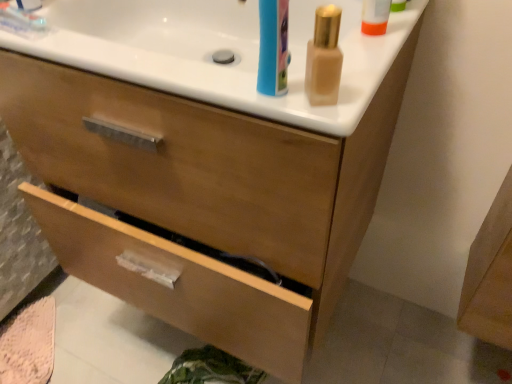
Question: From the image's perspective, is satin gold bottle at upper right above or below white glossy counter top at upper center?

Choices:
 (A) above
 (B) below

Answer: (B)

Question: Does point (325, 18) appear closer or farther from the camera than point (156, 11)?

Choices:
 (A) farther
 (B) closer

Answer: (B)

Question: Based on their relative distances, which object is nearer to the satin gold bottle at upper right?

Choices:
 (A) wooden drawer at lower center, which ranks as the 2th drawer in top-to-bottom order
 (B) white glossy counter top at upper center
 (C) wooden drawer at center, the second drawer from the bottom

Answer: (B)

Question: Which is nearer to the wooden drawer at center, the 1th drawer in the top-to-bottom sequence?

Choices:
 (A) satin gold bottle at upper right
 (B) white glossy counter top at upper center
 (C) wooden drawer at lower center, the first drawer when ordered from bottom to top

Answer: (C)